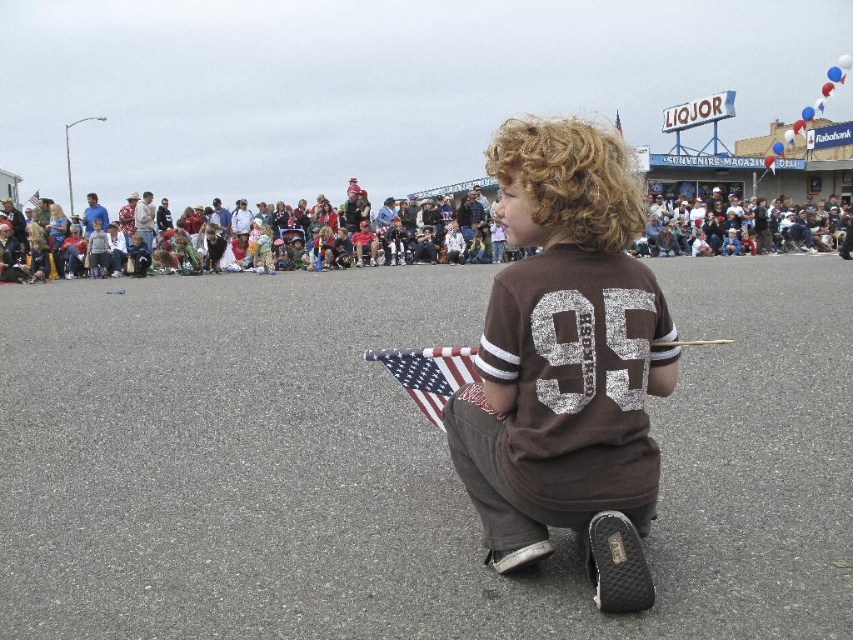
Does brown jersey at center have a lesser height compared to multicolored fabric crowd at center?

Indeed, brown jersey at center has a lesser height compared to multicolored fabric crowd at center.

Describe the element at coordinates (566, 364) in the screenshot. I see `brown jersey at center` at that location.

Locate an element on the screen. This screenshot has height=640, width=853. brown jersey at center is located at coordinates (566, 364).

Does multicolored fabric crowd at center appear under american flag at center?

No, multicolored fabric crowd at center is not below american flag at center.

Is multicolored fabric crowd at center thinner than american flag at center?

No, multicolored fabric crowd at center is not thinner than american flag at center.

Is point (453, 248) closer to viewer compared to point (416, 349)?

No, it is behind (416, 349).

Identify the location of multicolored fabric crowd at center. (746, 227).

Who is positioned more to the right, brown jersey at center or american flag at center?

Positioned to the right is brown jersey at center.

Between brown jersey at center and american flag at center, which one has less height?

Standing shorter between the two is american flag at center.

Where is `brown jersey at center`? brown jersey at center is located at coordinates (566, 364).

You are a GUI agent. You are given a task and a screenshot of the screen. Output one action in this format:
    pyautogui.click(x=<x>, y=<y>)
    Task: Click on the brown jersey at center
    
    Given the screenshot: What is the action you would take?
    pyautogui.click(x=566, y=364)